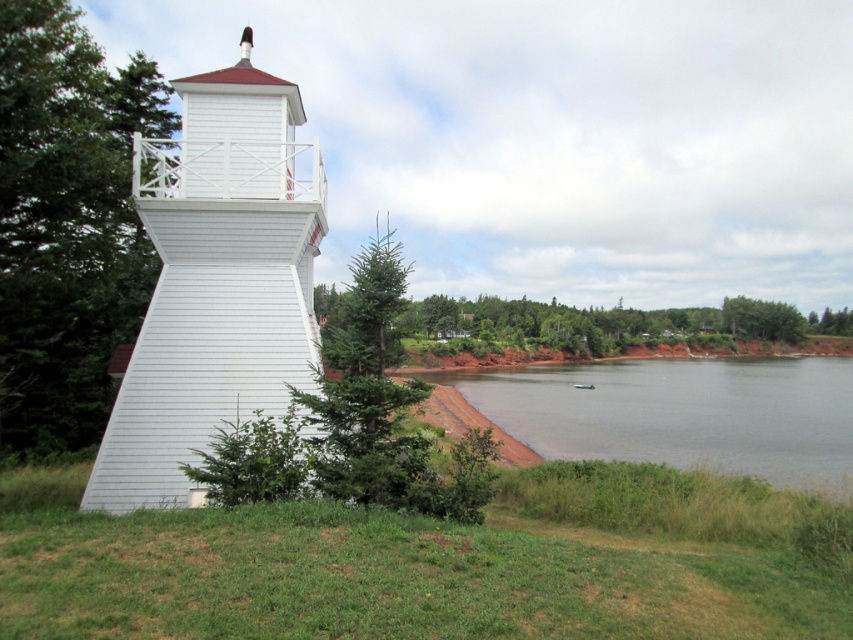
Which is above, green grassy at lower left or white wooden tower at left?

Positioned higher is white wooden tower at left.

What do you see at coordinates (393, 572) in the screenshot?
I see `green grassy at lower left` at bounding box center [393, 572].

Which is behind, point (306, 628) or point (250, 332)?

Positioned behind is point (250, 332).

Where is `green grassy at lower left`? The image size is (853, 640). green grassy at lower left is located at coordinates (393, 572).